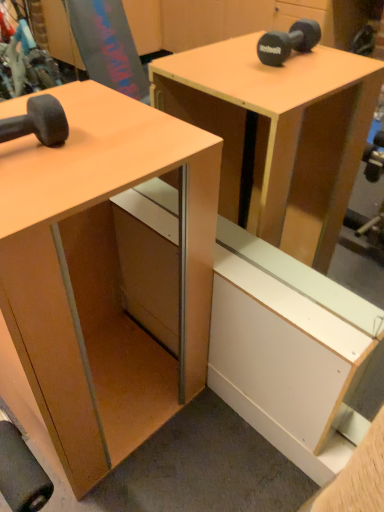
Describe the element at coordinates (101, 276) in the screenshot. The width and height of the screenshot is (384, 512). I see `matte wood desk at left` at that location.

At what (x,y) coordinates should I click in order to perform the action: click on matte wood desk at left. Please return your answer as a coordinate pair (x, y). Looking at the image, I should click on (101, 276).

Where is `matte black dumbbell at left`? Image resolution: width=384 pixels, height=512 pixels. matte black dumbbell at left is located at coordinates (38, 122).

The image size is (384, 512). What do you see at coordinates (38, 122) in the screenshot? I see `matte black dumbbell at left` at bounding box center [38, 122].

What is the approximate width of matte black dumbbell at left?

matte black dumbbell at left is 9.39 inches in width.

Locate an element on the screen. Image resolution: width=384 pixels, height=512 pixels. matte wood desk at left is located at coordinates point(101,276).

Considering the positions of objects matte black dumbbell at left and matte wood desk at left in the image provided, who is more to the right, matte black dumbbell at left or matte wood desk at left?

matte wood desk at left.

Who is more distant, matte black dumbbell at left or matte wood desk at left?

matte black dumbbell at left.

Is point (62, 122) positioned after point (112, 147)?

No, (62, 122) is closer to viewer.

From the image's perspective, between matte black dumbbell at left and matte wood desk at left, who is located below?

matte wood desk at left, from the image's perspective.

From a real-world perspective, is matte black dumbbell at left below matte wood desk at left?

Incorrect, from a real-world perspective, matte black dumbbell at left is higher than matte wood desk at left.

Which of these two, matte black dumbbell at left or matte wood desk at left, is wider?

matte wood desk at left is wider.

Can you confirm if matte black dumbbell at left is taller than matte wood desk at left?

Incorrect, the height of matte black dumbbell at left is not larger of that of matte wood desk at left.

Considering the sizes of matte black dumbbell at left and matte wood desk at left in the image, is matte black dumbbell at left bigger or smaller than matte wood desk at left?

Clearly, matte black dumbbell at left is smaller in size than matte wood desk at left.

Can matte wood desk at left be found inside matte black dumbbell at left?

No.

Is matte black dumbbell at left not close to matte wood desk at left?

No, there isn't a large distance between matte black dumbbell at left and matte wood desk at left.

Is matte black dumbbell at left oriented towards matte wood desk at left?

No, matte black dumbbell at left is not facing towards matte wood desk at left.

Can you tell me how much matte black dumbbell at left and matte wood desk at left differ in facing direction?

matte black dumbbell at left and matte wood desk at left are facing 1.64 degrees away from each other.

Locate an element on the screen. dumbbell behind the matte wood desk at left is located at coordinates (38, 122).

Which is more to the right, matte wood desk at left or matte black dumbbell at left?

From the viewer's perspective, matte wood desk at left appears more on the right side.

Relative to matte black dumbbell at left, is matte wood desk at left in front or behind?

matte wood desk at left is positioned closer to the viewer than matte black dumbbell at left.

Considering the points (78, 328) and (41, 140), which point is behind, point (78, 328) or point (41, 140)?

Point (78, 328)

From the image's perspective, relative to matte black dumbbell at left, is matte wood desk at left above or below?

From the image's perspective, matte wood desk at left appears below matte black dumbbell at left.

From a real-world perspective, between matte wood desk at left and matte black dumbbell at left, who is vertically higher?

matte black dumbbell at left.

Considering the sizes of matte wood desk at left and matte black dumbbell at left in the image, is matte wood desk at left wider or thinner than matte black dumbbell at left?

In the image, matte wood desk at left appears to be wider than matte black dumbbell at left.

Does matte wood desk at left have a lesser height compared to matte black dumbbell at left?

No.

Between matte wood desk at left and matte black dumbbell at left, which one has smaller size?

matte black dumbbell at left.

Looking at this image, could matte black dumbbell at left be considered to be inside matte wood desk at left?

No, matte black dumbbell at left is located outside of matte wood desk at left.

Would you say matte wood desk at left is a long distance from matte black dumbbell at left?

No, there isn't a large distance between matte wood desk at left and matte black dumbbell at left.

Is matte wood desk at left oriented towards matte black dumbbell at left?

No, matte wood desk at left is not facing towards matte black dumbbell at left.

How many degrees apart are the facing directions of matte wood desk at left and matte black dumbbell at left?

They differ by 1.64 degrees in their facing directions.

Measure the distance between matte wood desk at left and matte black dumbbell at left.

A distance of 18.71 inches exists between matte wood desk at left and matte black dumbbell at left.

What are the coordinates of `desk in front of the matte black dumbbell at left` in the screenshot? It's located at (101, 276).

The height and width of the screenshot is (512, 384). In the image, there is a matte wood desk at left. What are the coordinates of `dumbbell above it (from the image's perspective)` in the screenshot? It's located at (38, 122).

Identify the location of dumbbell on the left of matte wood desk at left. (38, 122).